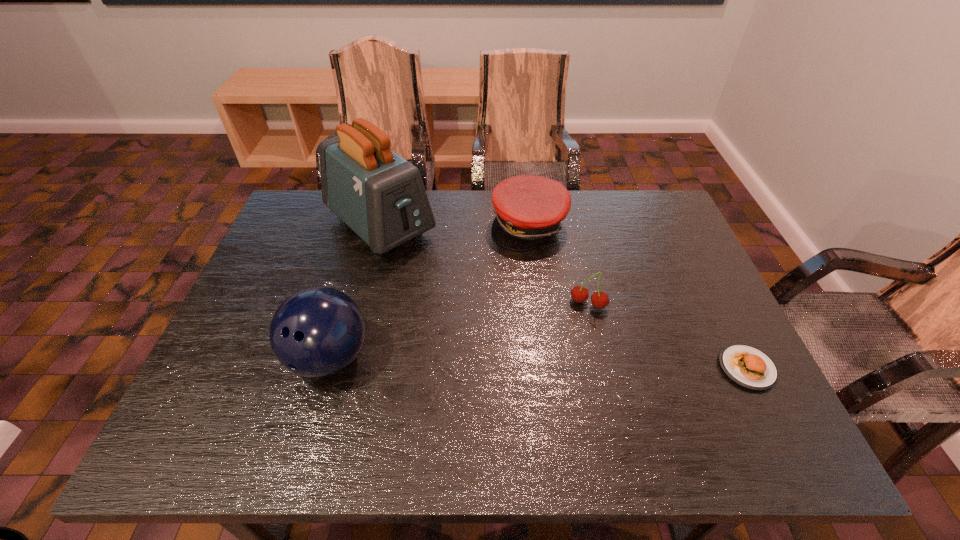
Choose which object is the nearest neighbor to the second tallest object. Please provide its 2D coordinates. Your answer should be formatted as a tuple, i.e. [(x, y)], where the tuple contains the x and y coordinates of a point satisfying the conditions above.

[(379, 195)]

The width and height of the screenshot is (960, 540). What are the coordinates of `free point that satisfies the following two spatial constraints: 1. on the surface of the second tallest object near the finger holes; 2. on the left side of the shortest object` in the screenshot? It's located at (326, 368).